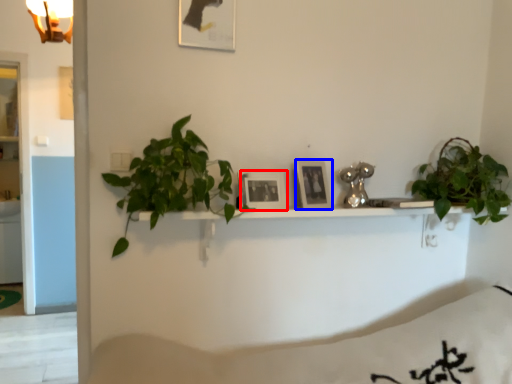
Question: Which point is closer to the camera, picture frame (highlighted by a red box) or picture frame (highlighted by a blue box)?

Choices:
 (A) picture frame
 (B) picture frame

Answer: (A)